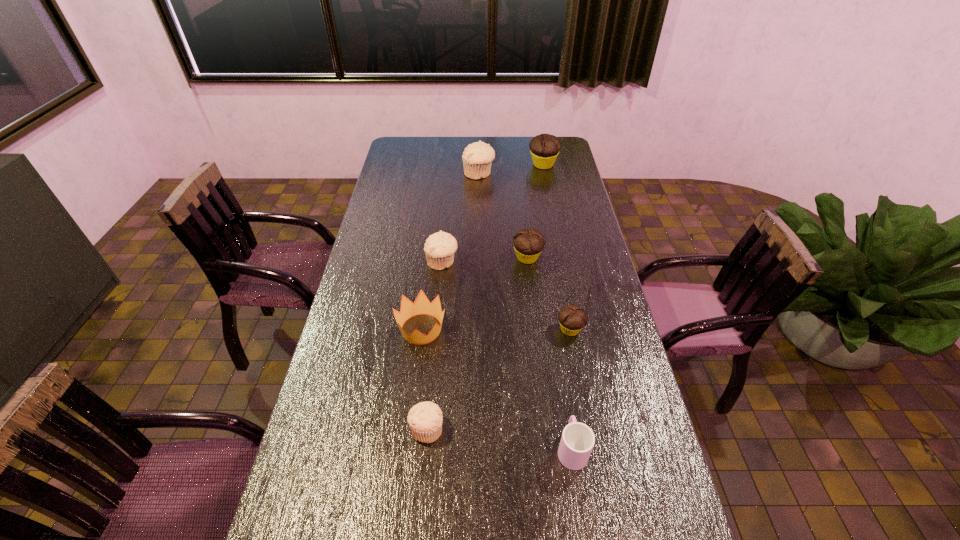
Where is `object located at the far edge`? Image resolution: width=960 pixels, height=540 pixels. object located at the far edge is located at coordinates (544, 148).

Locate an element on the screen. object at the far right corner is located at coordinates (544, 148).

Identify the location of vacant space at the far edge of the desktop. Image resolution: width=960 pixels, height=540 pixels. (449, 160).

This screenshot has height=540, width=960. I want to click on free space at the left edge, so click(413, 170).

In the image, there is a desktop. Where is `vacant space at the right edge`? The image size is (960, 540). vacant space at the right edge is located at coordinates (593, 233).

Locate an element on the screen. Image resolution: width=960 pixels, height=540 pixels. vacant region between the biggest beige muffin and the farthest chocolate muffin is located at coordinates (511, 169).

Find the location of a particular element. The image size is (960, 540). empty space that is in between the smallest beige muffin and the smallest chocolate muffin is located at coordinates (498, 379).

Locate an element on the screen. free space between the biggest chocolate muffin and the gold crown is located at coordinates (482, 247).

Locate an element on the screen. The height and width of the screenshot is (540, 960). vacant area between the cup and the second farthest beige muffin is located at coordinates (507, 355).

The image size is (960, 540). I want to click on free space between the crown and the second smallest beige muffin, so click(x=432, y=295).